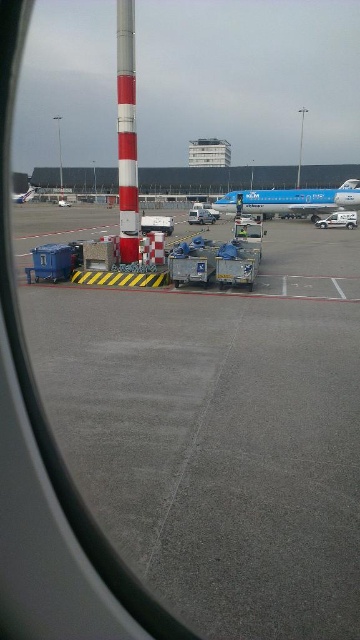
Question: Which point is closer to the camera taking this photo?

Choices:
 (A) (200, 220)
 (B) (354, 212)

Answer: (B)

Question: Does metallic silver van at center lie in front of metallic silver airplane at left?

Choices:
 (A) no
 (B) yes

Answer: (B)

Question: Which of the following is the closest to the observer?

Choices:
 (A) (34, 186)
 (B) (191, 209)
 (C) (129, 243)

Answer: (C)

Question: Estimate the real-world distances between objects in this image. Which object is closer to the metallic silver airplane at left?

Choices:
 (A) red/white striped pole at left
 (B) white matte van at center
 (C) metallic silver van at center

Answer: (C)

Question: Can you confirm if metallic silver van at center is bigger than metallic silver airplane at left?

Choices:
 (A) yes
 (B) no

Answer: (B)

Question: Is blue metallic airplane at center further to camera compared to white matte van at center?

Choices:
 (A) no
 (B) yes

Answer: (A)